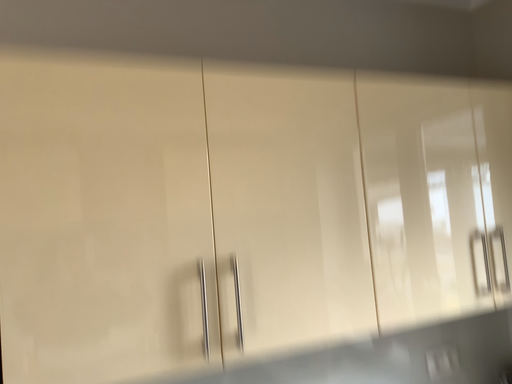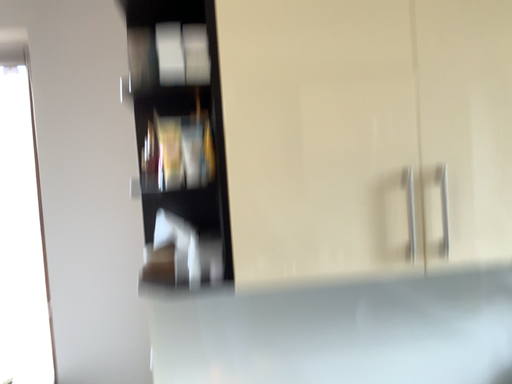
Question: How did the camera likely rotate when shooting the video?

Choices:
 (A) rotated upward
 (B) rotated downward

Answer: (B)